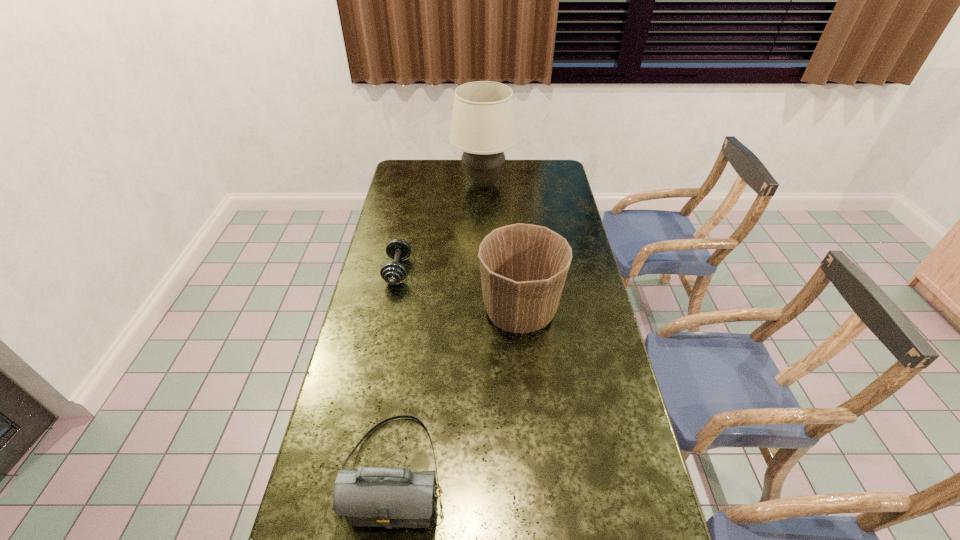
Find the location of a particular element. The height and width of the screenshot is (540, 960). object at the far edge is located at coordinates (483, 125).

Image resolution: width=960 pixels, height=540 pixels. I want to click on shoulder bag at the left edge, so click(x=386, y=497).

At what (x,y) coordinates should I click in order to perform the action: click on dumbbell that is positioned at the left edge. Please return your answer as a coordinate pair (x, y). The image size is (960, 540). Looking at the image, I should click on (393, 273).

I want to click on object that is at the right edge, so click(523, 267).

Identify the location of free region at the far edge of the desktop. (431, 175).

Image resolution: width=960 pixels, height=540 pixels. What are the coordinates of `free space at the left edge of the desktop` in the screenshot? It's located at (335, 402).

This screenshot has width=960, height=540. I want to click on free spot at the right edge of the desktop, so click(x=579, y=393).

Where is `vacant position at the far left corner of the desktop`? The image size is (960, 540). vacant position at the far left corner of the desktop is located at coordinates (402, 167).

The image size is (960, 540). I want to click on blank space at the far right corner, so click(564, 176).

Locate an element on the screen. This screenshot has width=960, height=540. vacant space in between the third tallest object and the lampshade is located at coordinates (439, 328).